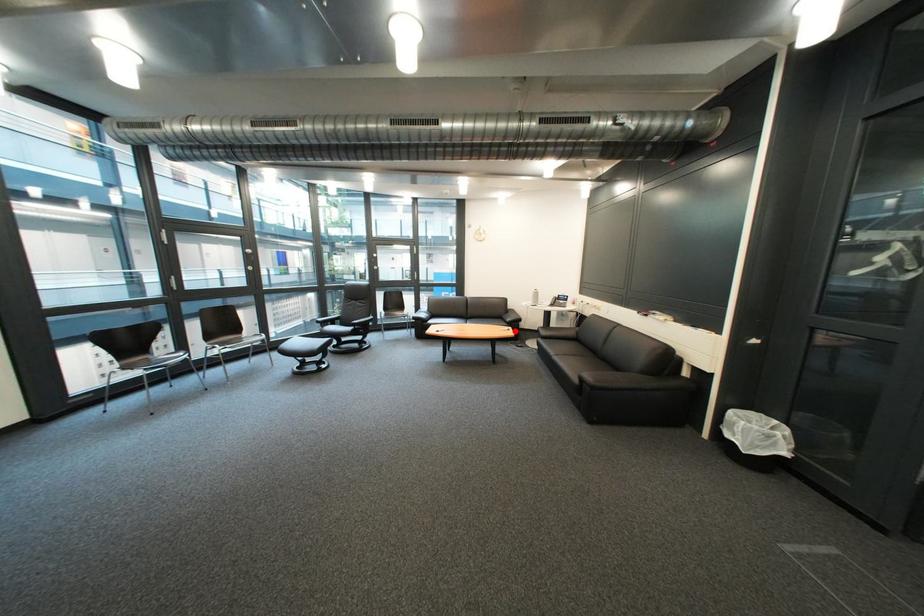
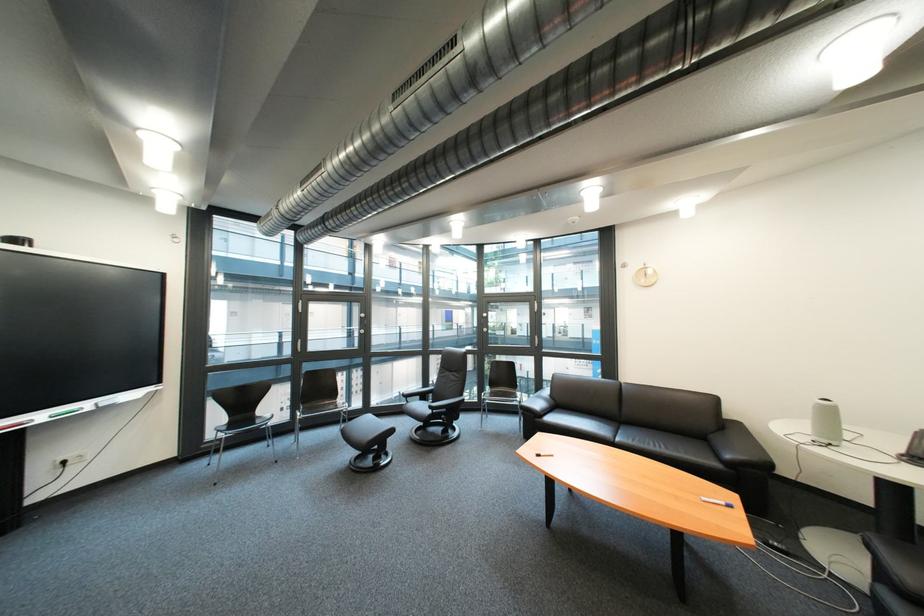
Find the pixel in the second image that matches the highlighted location in the first image.

(718, 501)